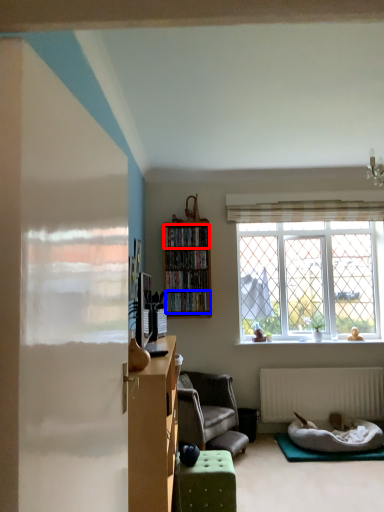
Question: Among these objects, which one is farthest to the camera, cabinet (highlighted by a red box) or shelf (highlighted by a blue box)?

Choices:
 (A) cabinet
 (B) shelf

Answer: (A)